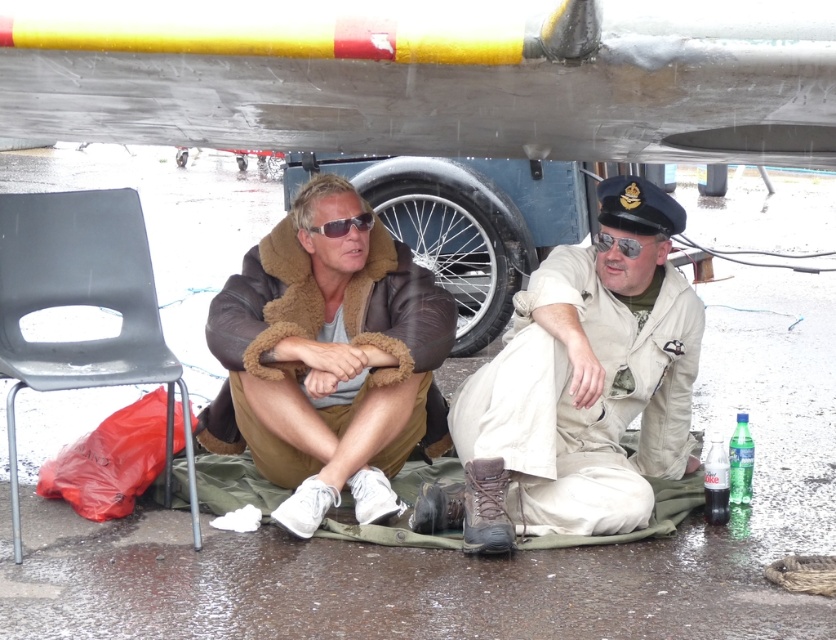
Based on the scene description, which object is taller between the khaki fabric uniform at lower center and the matte brown aviator goggles at center?

The khaki fabric uniform at lower center is taller than the matte brown aviator goggles at center according to the description.

You are a maintenance worker needing to place the matte brown aviator goggles at center onto the black plastic chair at lower left. Can you place the goggles on the chair without adjusting their positions?

The black plastic chair at lower left is taller than matte brown aviator goggles at center, so yes, you can place the matte brown aviator goggles at center on the chair without needing to adjust their positions since the chair is tall enough to accommodate them.

You are a maintenance worker needing to access the tire for inspection. Given the black plastic chair at lower left is blocking the path to the metallic silver tire at center, can you move the chair to gain access?

The black plastic chair at lower left is positioned under the metallic silver tire at center, so moving the chair might be necessary to access the tire for inspection.